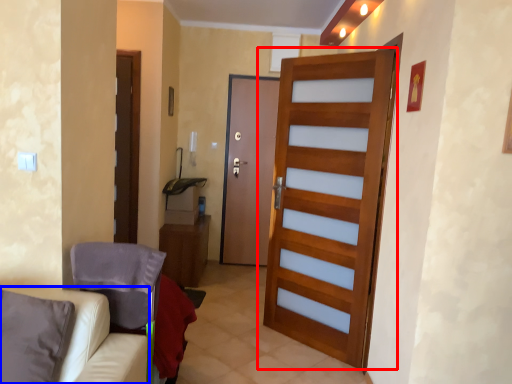
Question: Among these objects, which one is farthest to the camera, door (highlighted by a red box) or furniture (highlighted by a blue box)?

Choices:
 (A) door
 (B) furniture

Answer: (A)